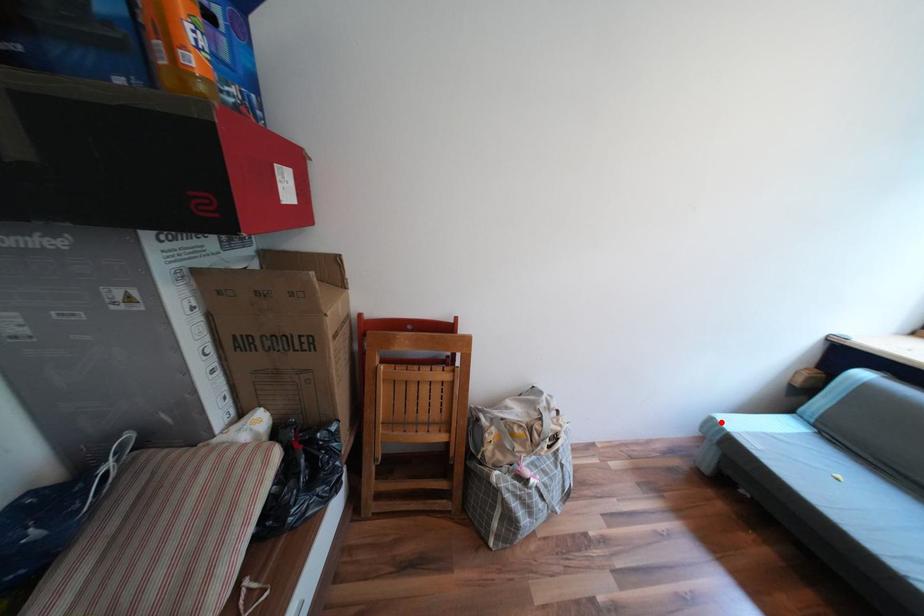
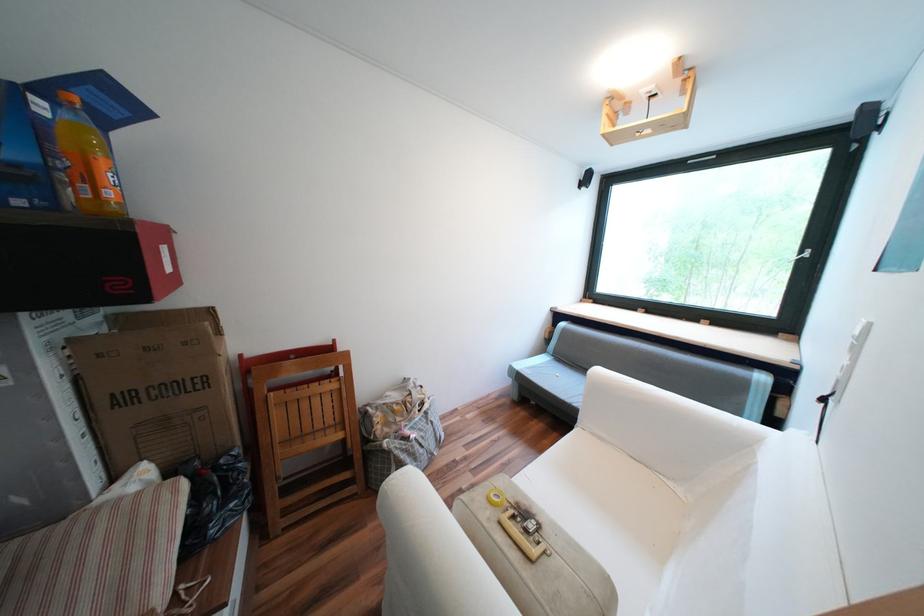
In the second image, find the point that corresponds to the highlighted location in the first image.

(520, 369)